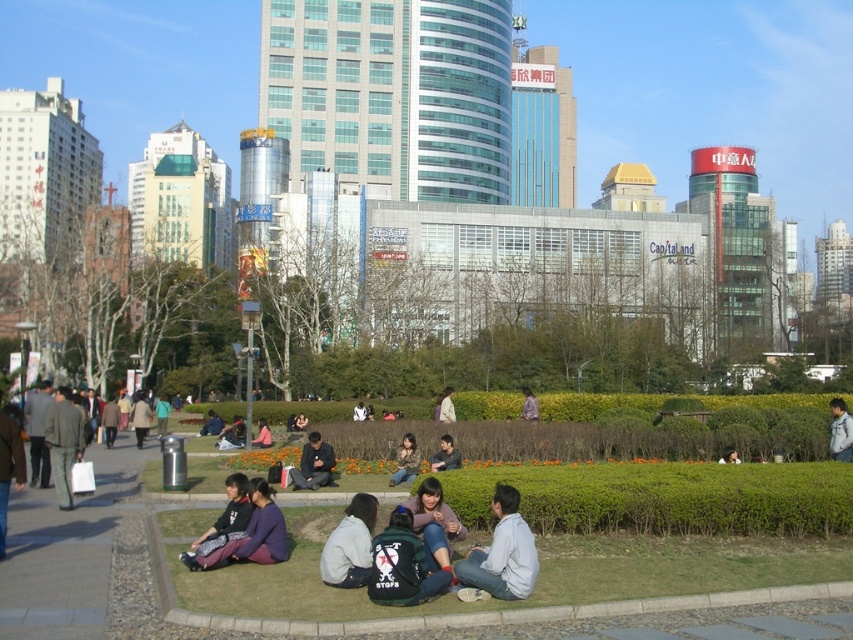
Question: Which object appears closest to the camera in this image?

Choices:
 (A) camouflage jacket at center
 (B) dark gray jacket at center
 (C) dark gray jacket at lower right

Answer: (A)

Question: Can you confirm if dark gray jacket at center is positioned to the right of dark gray jacket at lower right?

Choices:
 (A) no
 (B) yes

Answer: (A)

Question: Does light gray fabric jacket at lower center appear over dark gray sweater at center?

Choices:
 (A) no
 (B) yes

Answer: (B)

Question: Which of the following is the closest to the observer?

Choices:
 (A) (213, 525)
 (B) (299, 467)
 (C) (260, 428)
 (D) (445, 396)

Answer: (A)

Question: Which point is farther to the camera?

Choices:
 (A) (326, 508)
 (B) (412, 467)
 (C) (271, 440)

Answer: (C)

Question: Does light gray cotton shirt at lower center have a smaller size compared to denim jacket at center?

Choices:
 (A) yes
 (B) no

Answer: (A)